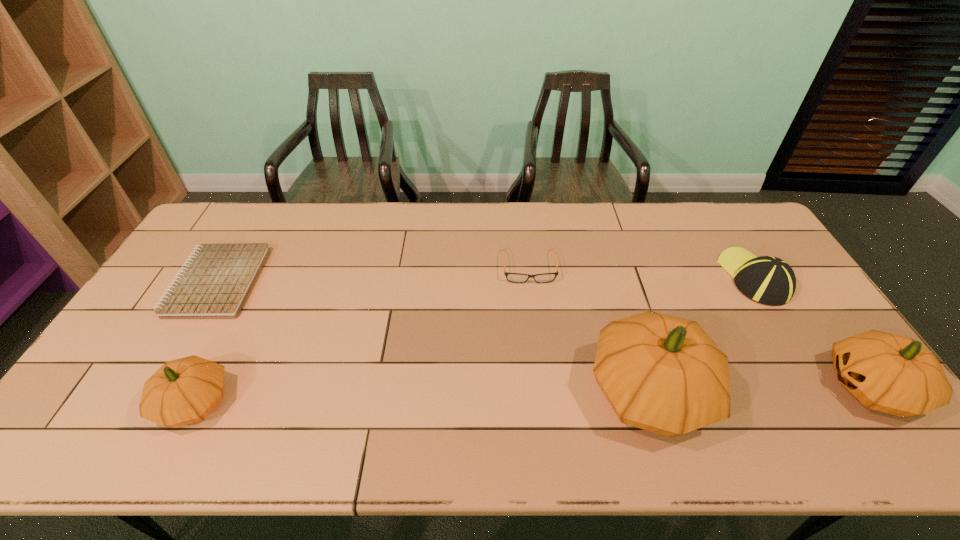
At what (x,y) coordinates should I click in order to perform the action: click on gourd that is the second closest one to the spectacles. Please return your answer as a coordinate pair (x, y). The width and height of the screenshot is (960, 540). Looking at the image, I should click on (894, 374).

Identify which gourd is the closest to the leftmost gourd. Please provide its 2D coordinates. Your answer should be formatted as a tuple, i.e. [(x, y)], where the tuple contains the x and y coordinates of a point satisfying the conditions above.

[(664, 374)]

Identify the location of blank area in the image that satisfies the following two spatial constraints: 1. on the front-facing side of the second shortest object; 2. on the side of the shortest gourd with the carved face. This screenshot has height=540, width=960. (544, 402).